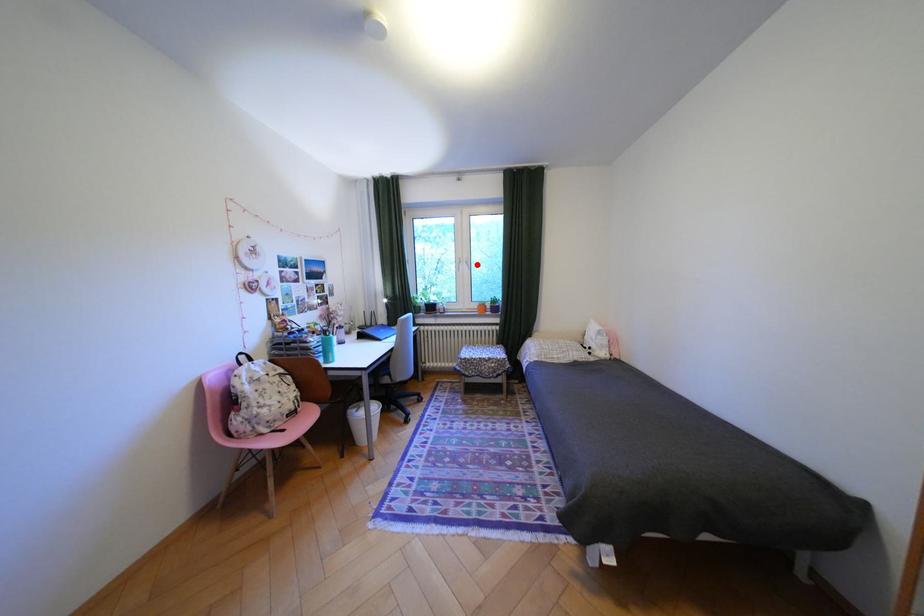
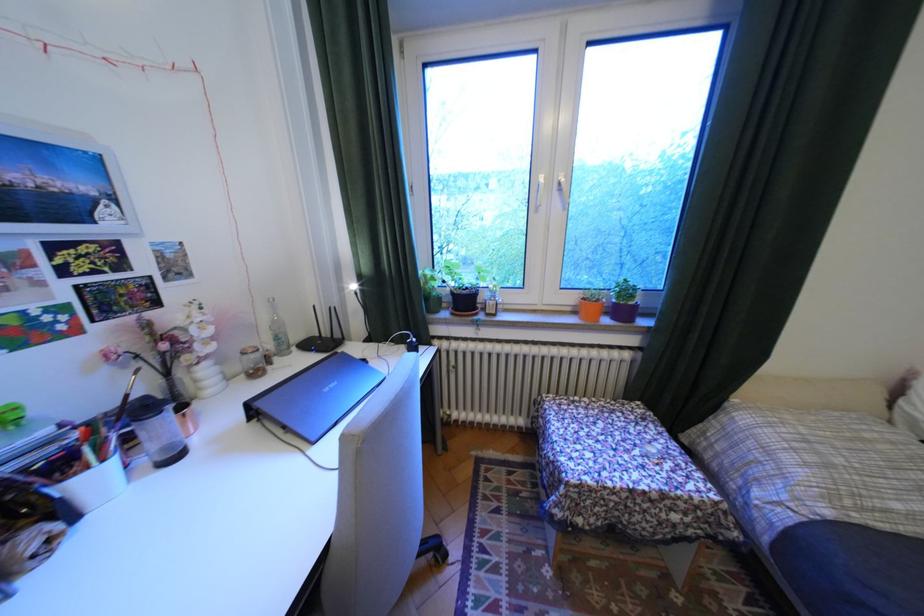
Where in the second image is the point corresponding to the highlighted location from the first image?

(566, 195)